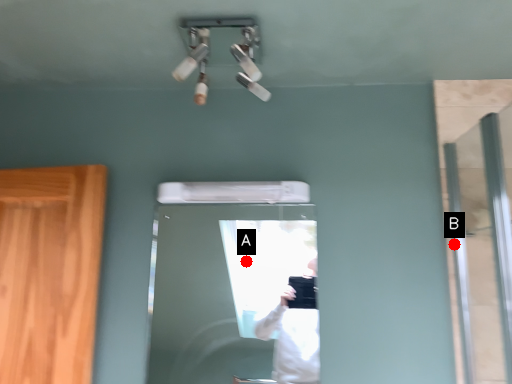
Question: Two points are circled on the image, labeled by A and B beside each circle. Which of the following is the closest to the observer?

Choices:
 (A) A is closer
 (B) B is closer

Answer: (B)